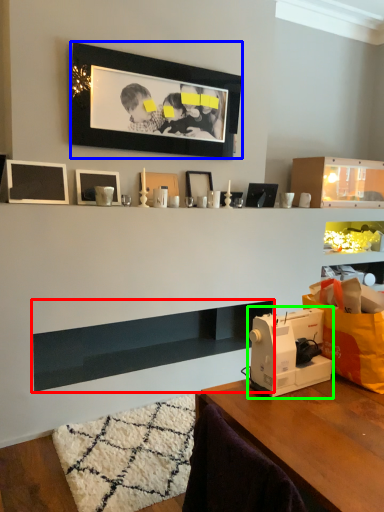
Question: Which object is positioned farthest from shelf (highlighted by a red box)? Select from picture frame (highlighted by a blue box) and sewing machine (highlighted by a green box).

Choices:
 (A) picture frame
 (B) sewing machine

Answer: (A)